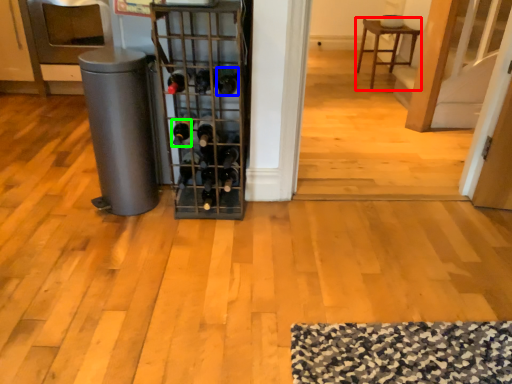
Question: Which object is the closest to the furniture (highlighted by a red box)? Choose among these: wine bottle (highlighted by a blue box) or wine bottle (highlighted by a green box).

Choices:
 (A) wine bottle
 (B) wine bottle

Answer: (A)